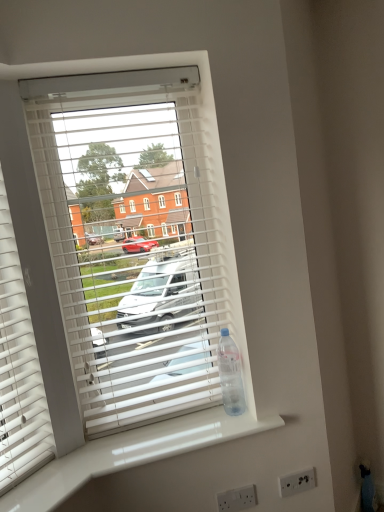
Question: Is white plastic blinds at center positioned with its back to clear plastic bottle at right?

Choices:
 (A) no
 (B) yes

Answer: (A)

Question: Is white plastic blinds at center oriented towards clear plastic bottle at right?

Choices:
 (A) yes
 (B) no

Answer: (A)

Question: From the image's perspective, is white plastic blinds at center below clear plastic bottle at right?

Choices:
 (A) no
 (B) yes

Answer: (A)

Question: Considering the relative sizes of white plastic blinds at center and clear plastic bottle at right in the image provided, is white plastic blinds at center shorter than clear plastic bottle at right?

Choices:
 (A) no
 (B) yes

Answer: (A)

Question: Are white plastic blinds at center and clear plastic bottle at right far apart?

Choices:
 (A) no
 (B) yes

Answer: (A)

Question: Can you confirm if white plastic blinds at center is positioned to the right of clear plastic bottle at right?

Choices:
 (A) yes
 (B) no

Answer: (B)

Question: Is white plastic blinds at center smaller than white glossy counter top at lower center?

Choices:
 (A) no
 (B) yes

Answer: (A)

Question: Is white plastic blinds at center oriented away from white glossy counter top at lower center?

Choices:
 (A) no
 (B) yes

Answer: (A)

Question: Would you consider white plastic blinds at center to be distant from white glossy counter top at lower center?

Choices:
 (A) no
 (B) yes

Answer: (A)

Question: Does white plastic blinds at center come behind white glossy counter top at lower center?

Choices:
 (A) yes
 (B) no

Answer: (A)

Question: Can we say white plastic blinds at center lies outside white glossy counter top at lower center?

Choices:
 (A) no
 (B) yes

Answer: (B)

Question: Could white glossy counter top at lower center be considered to be inside white plastic blinds at center?

Choices:
 (A) yes
 (B) no

Answer: (B)

Question: Considering the relative sizes of white glossy counter top at lower center and white plastic blinds at center in the image provided, is white glossy counter top at lower center wider than white plastic blinds at center?

Choices:
 (A) no
 (B) yes

Answer: (B)